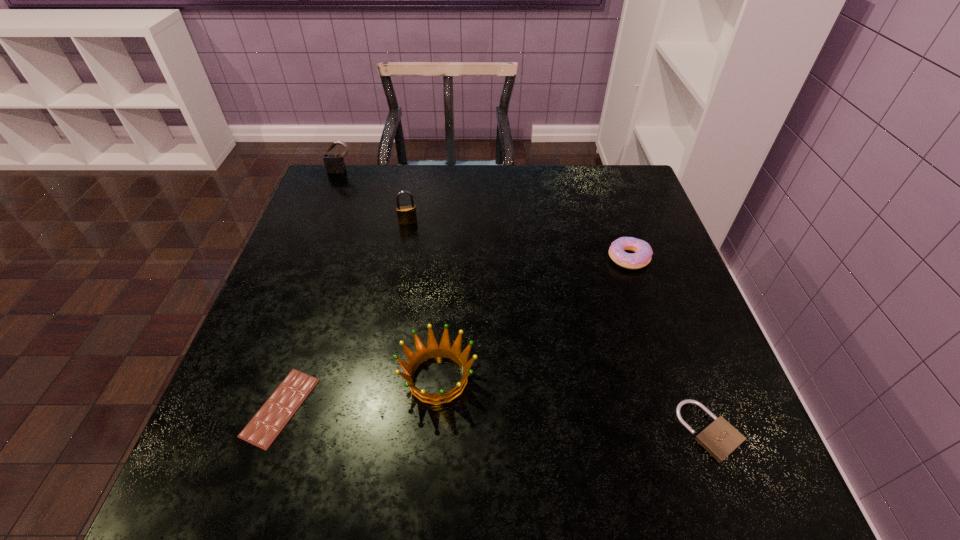
You are a GUI agent. You are given a task and a screenshot of the screen. Output one action in this format:
    pyautogui.click(x=<x>, y=<y>)
    Task: Click on the shortest object
    The image size is (960, 540).
    Given the screenshot: What is the action you would take?
    pyautogui.click(x=265, y=426)

Locate an element on the screen. The image size is (960, 540). vacant area located 0.300m with the keyhole on the front of the farthest padlock is located at coordinates (315, 238).

Identify the location of free space located on the right of the fourth object from right to left. This screenshot has height=540, width=960. (480, 222).

Locate an element on the screen. The height and width of the screenshot is (540, 960). free space located on the right of the third tallest object is located at coordinates (641, 378).

The image size is (960, 540). Find the location of `vacant space located 0.070m on the left of the fourth tallest object`. vacant space located 0.070m on the left of the fourth tallest object is located at coordinates (580, 258).

At what (x,y) coordinates should I click in order to perform the action: click on vacant space located 0.250m on the left of the shortest padlock. Please return your answer as a coordinate pair (x, y). The image size is (960, 540). Looking at the image, I should click on (540, 431).

Image resolution: width=960 pixels, height=540 pixels. I want to click on free space located on the right of the shortest object, so click(x=447, y=407).

This screenshot has width=960, height=540. Identify the location of object present at the far edge. (334, 163).

Where is `padlock at the near edge`? This screenshot has height=540, width=960. padlock at the near edge is located at coordinates pyautogui.click(x=720, y=438).

Locate an element on the screen. The height and width of the screenshot is (540, 960). chocolate bar located in the near edge section of the desktop is located at coordinates (265, 426).